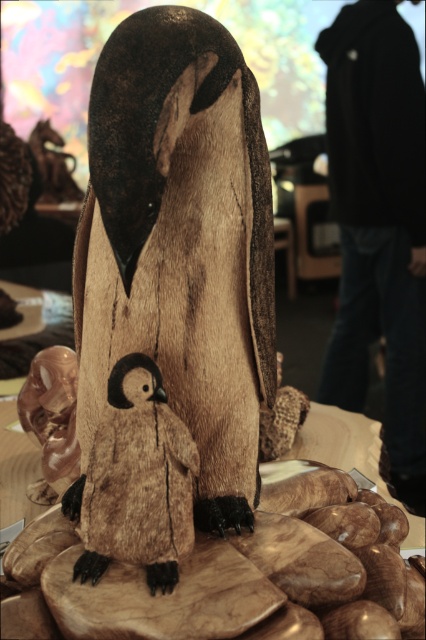
Is brown fuzzy penguin at center smaller than translucent amber penguin at lower left?

Yes.

Is brown fuzzy penguin at center bigger than translucent amber penguin at lower left?

Actually, brown fuzzy penguin at center might be smaller than translucent amber penguin at lower left.

Where is `brown fuzzy penguin at center`? This screenshot has height=640, width=426. brown fuzzy penguin at center is located at coordinates (135, 481).

Based on the photo, can you confirm if wooden penguin at center is positioned to the right of brown fuzzy penguin at center?

Indeed, wooden penguin at center is positioned on the right side of brown fuzzy penguin at center.

Is wooden penguin at center closer to camera compared to brown fuzzy penguin at center?

That is True.

Does point (187, 76) lie behind point (167, 449)?

No, it is in front of (167, 449).

You are a GUI agent. You are given a task and a screenshot of the screen. Output one action in this format:
    pyautogui.click(x=<x>, y=<y>)
    Task: Click on the wooden penguin at center
    Image resolution: width=426 pixels, height=640 pixels.
    Given the screenshot: What is the action you would take?
    pyautogui.click(x=181, y=243)

Who is taller, wooden penguin at center or translucent amber penguin at lower left?

wooden penguin at center is taller.

Looking at this image, does wooden penguin at center have a lesser height compared to translucent amber penguin at lower left?

Incorrect, wooden penguin at center's height does not fall short of translucent amber penguin at lower left's.

The height and width of the screenshot is (640, 426). Identify the location of wooden penguin at center. (181, 243).

Find the location of a particular element. Image resolution: width=426 pixels, height=640 pixels. wooden penguin at center is located at coordinates click(x=181, y=243).